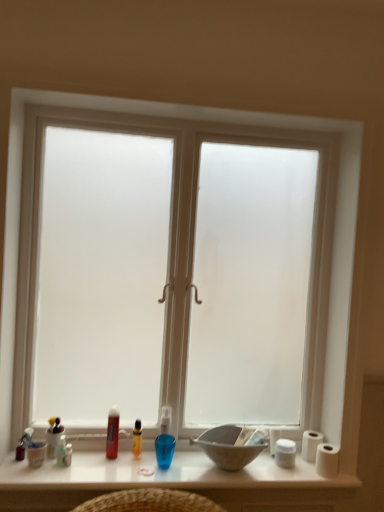
You are a GUI agent. You are given a task and a screenshot of the screen. Output one action in this format:
    pyautogui.click(x=<x>, y=<y>)
    Task: Click on the free region on the left part of matte white cup at lower left, placed as the 2th toiletry when sorted from left to right
    
    Given the screenshot: What is the action you would take?
    pyautogui.click(x=20, y=466)